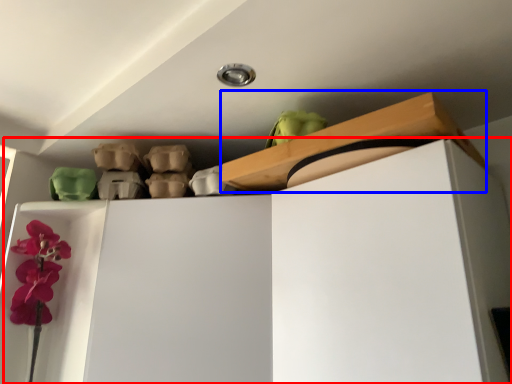
Question: Among these objects, which one is nearest to the camera, dresser (highlighted by a red box) or shelf (highlighted by a blue box)?

Choices:
 (A) dresser
 (B) shelf

Answer: (A)